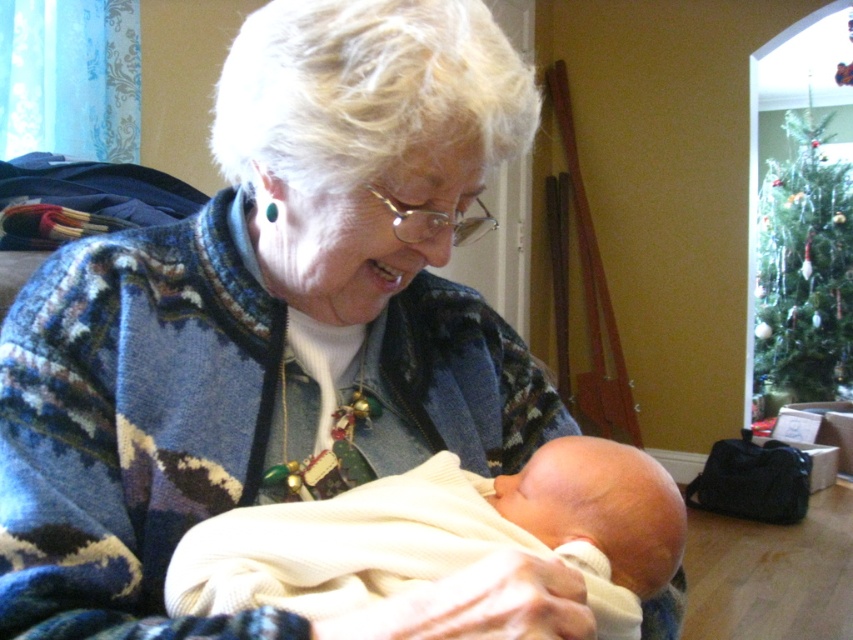
You are an interior designer planning to place a decorative item between the white knit sweater at center and the green matte christmas tree at upper right. Which object should you place the item closer to if you want it to be closer to the narrower object?

The white knit sweater at center is narrower than the green matte christmas tree at upper right, so place the decorative item closer to the white knit sweater at center to be near the narrower object.

You are organizing a photo shoot and need to ensure that all objects in the image are properly framed. Given the white knit sweater at center and the green matte christmas tree at upper right, which object takes up more area in the image?

The green matte christmas tree at upper right takes up more area in the image because it occupies more space than the white knit sweater at center.

You are a delivery robot that needs to deliver a gift to the green matte christmas tree at upper right. You are currently positioned near the white knit sweater at center. Can you reach the tree without moving more than 15 feet?

The distance between the white knit sweater at center and the green matte christmas tree at upper right is 16.39 feet, which is more than 15 feet. Therefore, the delivery robot cannot reach the tree without moving more than 15 feet.